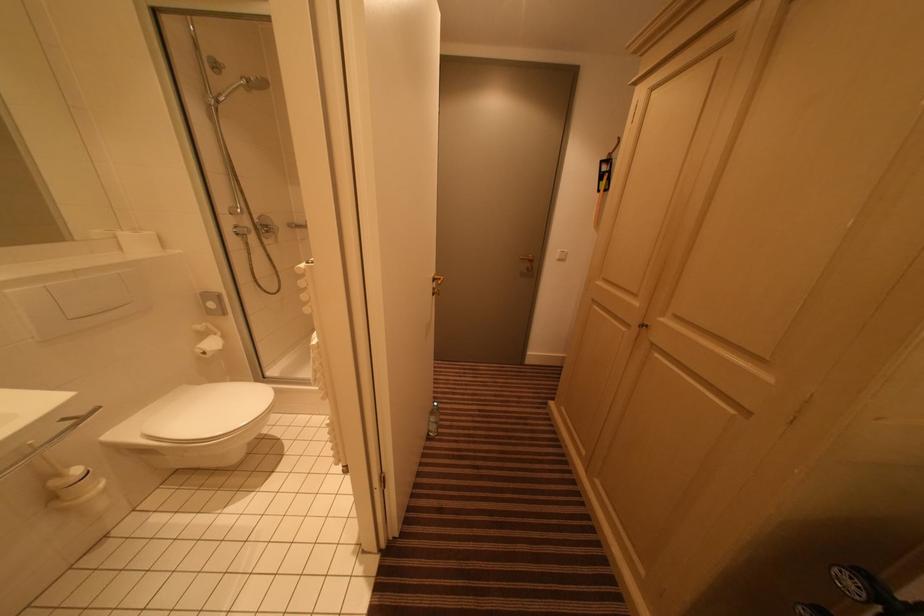
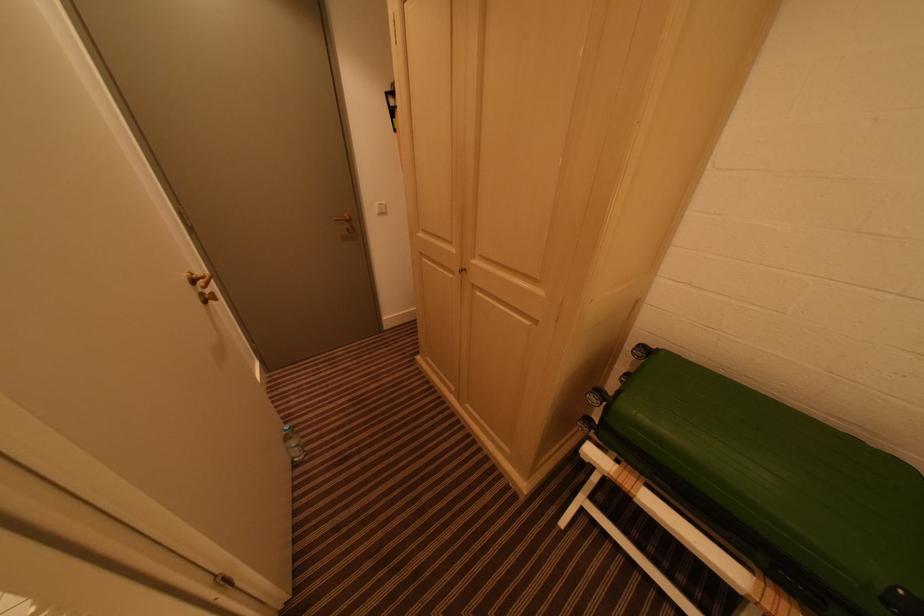
Where in the second image is the point corresponding to point 641,326 from the first image?

(464, 272)